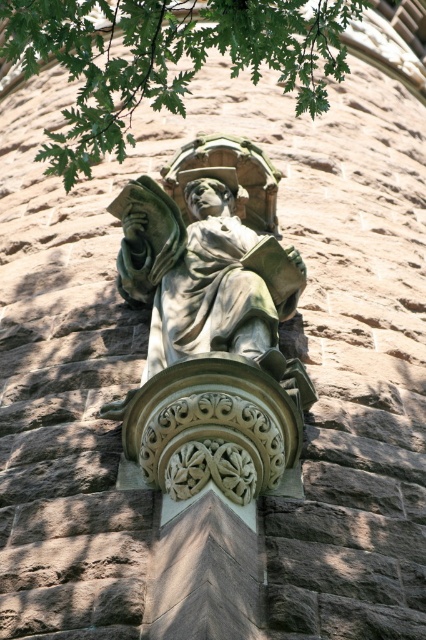
Question: Among these points, which one is nearest to the camera?

Choices:
 (A) (271, 260)
 (B) (288, 61)

Answer: (A)

Question: Can you confirm if green stone statue at center is positioned to the right of green leafy tree at upper center?

Choices:
 (A) yes
 (B) no

Answer: (A)

Question: Does green stone statue at center appear over green leafy tree at upper center?

Choices:
 (A) no
 (B) yes

Answer: (A)

Question: Is green stone statue at center thinner than green leafy tree at upper center?

Choices:
 (A) yes
 (B) no

Answer: (A)

Question: Which point appears farthest from the camera in this image?

Choices:
 (A) (170, 212)
 (B) (0, 1)

Answer: (A)

Question: Which of the following is the farthest from the observer?

Choices:
 (A) (89, 141)
 (B) (155, 298)

Answer: (B)